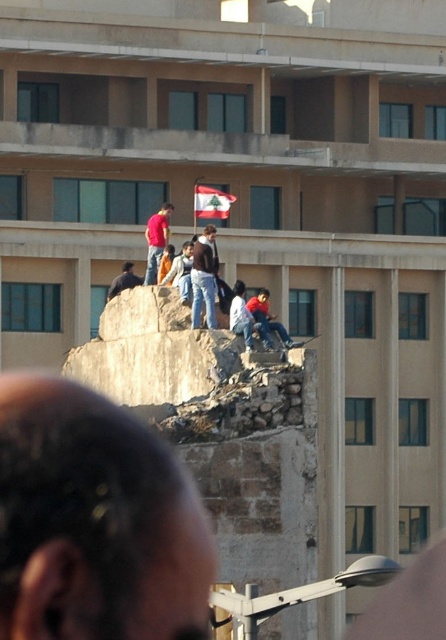
Question: Does bald head at center have a larger size compared to matte red shirt at center?

Choices:
 (A) no
 (B) yes

Answer: (B)

Question: Which point is closer to the camera taking this photo?

Choices:
 (A) (159, 218)
 (B) (123, 269)
 (C) (71, 392)
 (D) (194, 312)

Answer: (C)

Question: Is matte red shirt at center further to the viewer compared to white fabric flag at center?

Choices:
 (A) yes
 (B) no

Answer: (B)

Question: Is dark brown leather jacket at center in front of white fabric flag at center?

Choices:
 (A) yes
 (B) no

Answer: (A)

Question: Which point appears farthest from the camera in this image?

Choices:
 (A) (199, 236)
 (B) (203, 209)
 (C) (114, 296)
 (D) (165, 218)

Answer: (B)

Question: Among these points, which one is nearest to the camera?

Choices:
 (A) (131, 268)
 (B) (226, 205)

Answer: (A)